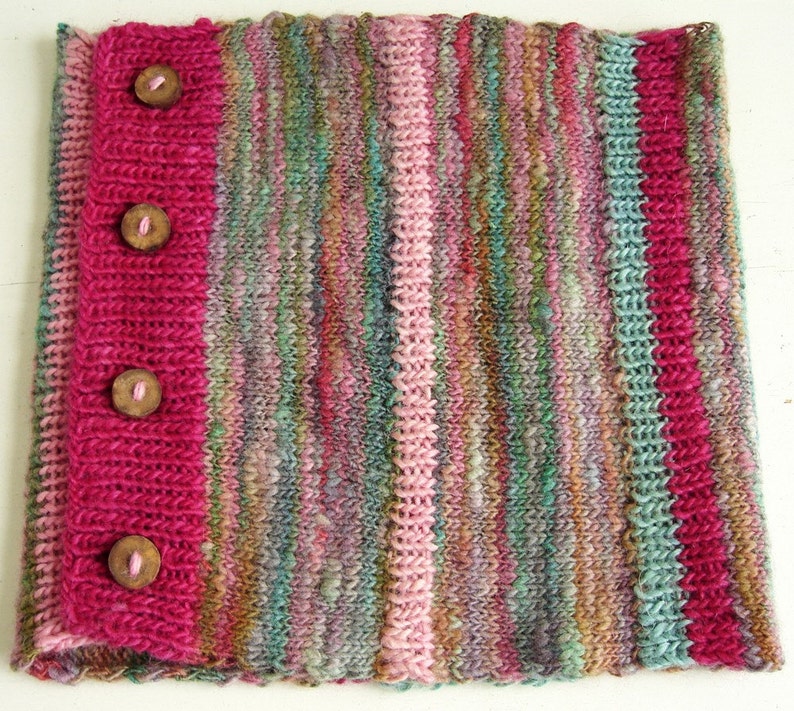
The image size is (794, 711). What are the coordinates of `fabric` in the screenshot? It's located at (89, 52), (695, 75), (83, 606), (715, 613).